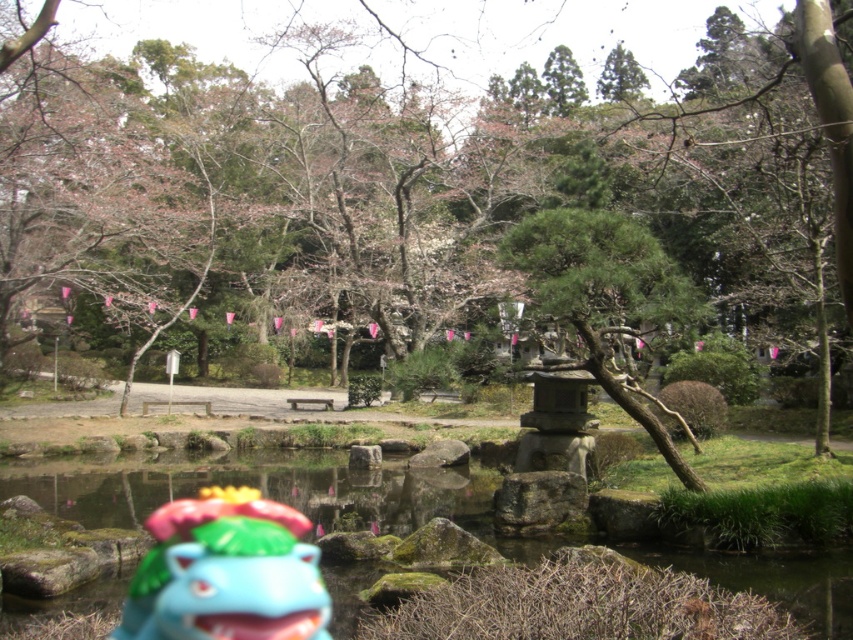
Question: Is green mossy rocks at center above shiny plastic toy at lower center?

Choices:
 (A) yes
 (B) no

Answer: (B)

Question: Is green mossy rocks at center to the right of shiny plastic toy at lower center from the viewer's perspective?

Choices:
 (A) yes
 (B) no

Answer: (A)

Question: Which point is farther to the camera?

Choices:
 (A) green mossy rocks at center
 (B) shiny plastic toy at lower center

Answer: (B)

Question: Is green mossy rocks at center below shiny plastic toy at lower center?

Choices:
 (A) yes
 (B) no

Answer: (A)